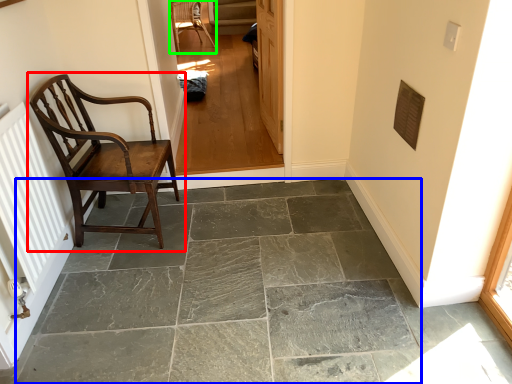
Question: Which object is positioned farthest from chair (highlighted by a red box)? Select from concrete (highlighted by a blue box) and chair (highlighted by a green box).

Choices:
 (A) concrete
 (B) chair

Answer: (B)